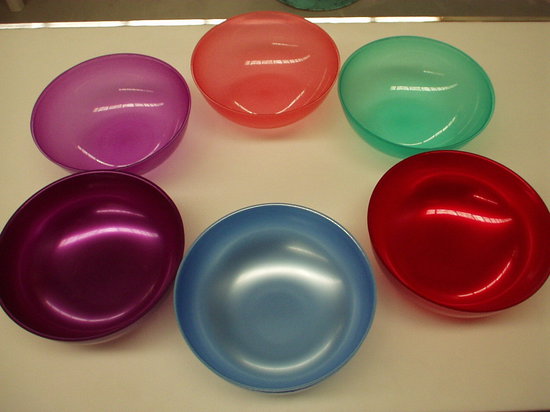
Locate an element on the screen. The image size is (550, 412). dark purple bowl is located at coordinates (119, 241).